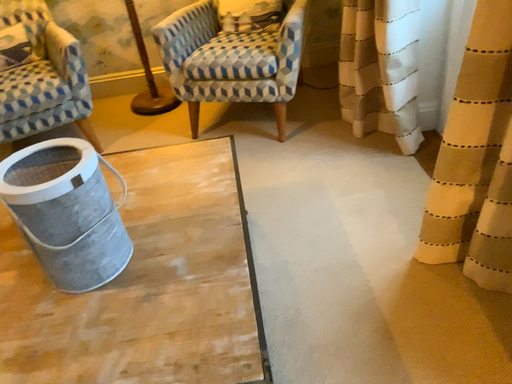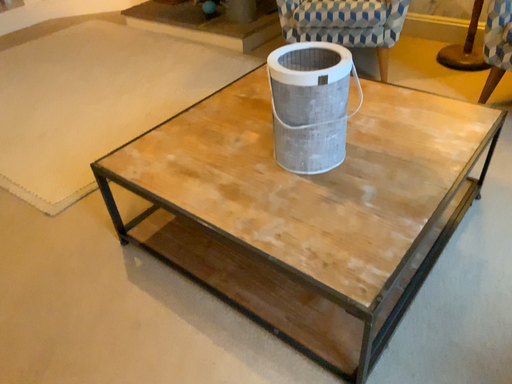
Question: How did the camera likely rotate when shooting the video?

Choices:
 (A) rotated left
 (B) rotated right

Answer: (A)